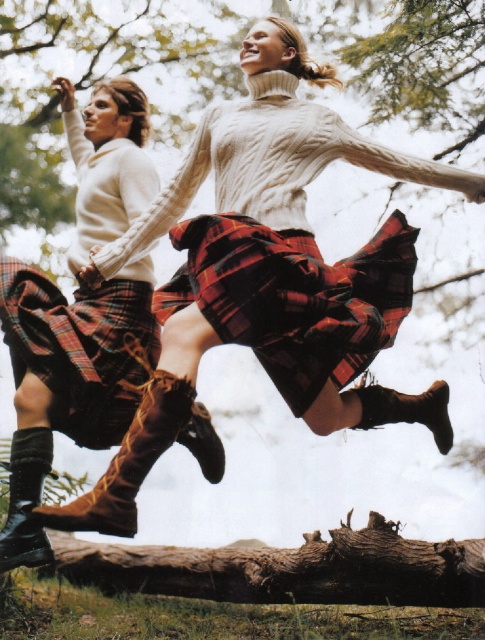
Question: Can you confirm if plaid fabric skirt at center is wider than brown suede boot at lower center?

Choices:
 (A) yes
 (B) no

Answer: (A)

Question: Which of the following is the farthest from the observer?

Choices:
 (A) (451, 435)
 (B) (170, 387)
 (C) (110, 438)

Answer: (A)

Question: Does plaid fabric skirt at center come behind black leather boot at lower left?

Choices:
 (A) no
 (B) yes

Answer: (A)

Question: Which of the following is the closest to the observer?

Choices:
 (A) black leather boot at lower left
 (B) plaid fabric skirt at center

Answer: (B)

Question: Can you confirm if brown suede boot at lower left is positioned below black leather boot at lower left?

Choices:
 (A) no
 (B) yes

Answer: (A)

Question: Which point appears closest to the camera in this image?

Choices:
 (A) (19, 513)
 (B) (387, 273)

Answer: (A)